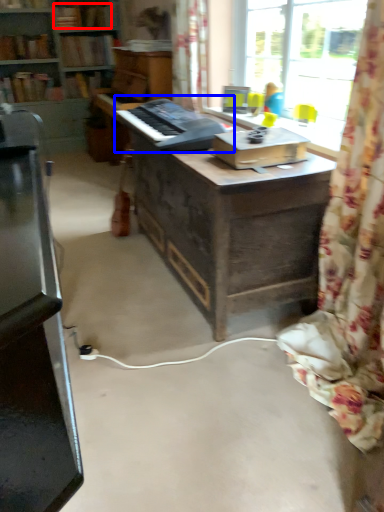
Question: Which object appears farthest to the camera in this image, book (highlighted by a red box) or musical keyboard (highlighted by a blue box)?

Choices:
 (A) book
 (B) musical keyboard

Answer: (A)